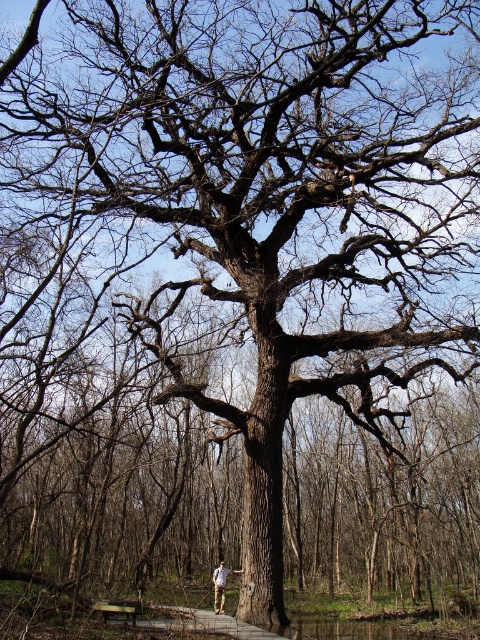
You are standing on the wooden walkway in the forest and see two points marked in the image. Which point, point [126,616] or point [214,584], is closer to you?

Point [126,616] is closer to the viewer than point [214,584].

You are standing on the wooden walkway in the forest scene. You notice a wooden bench at lower center and khaki pants at center. Which object is located higher in the image?

The wooden bench at lower center is positioned over khaki pants at center, so the wooden bench at lower center is higher in the image.